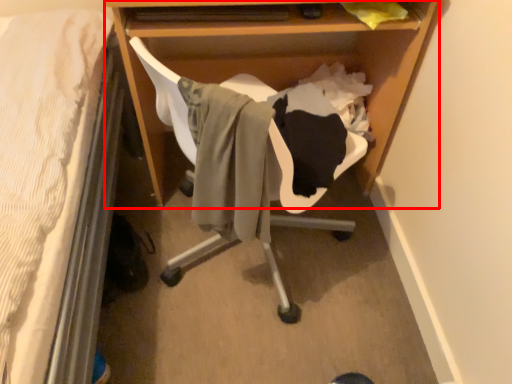
Question: From the image's perspective, where is desk (annotated by the red box) located relative to swivel chair?

Choices:
 (A) below
 (B) above

Answer: (B)